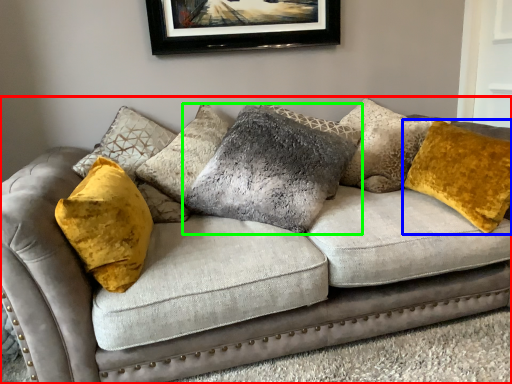
Question: Which object is the farthest from studio couch (highlighted by a red box)? Choose among these: pillow (highlighted by a blue box) or pillow (highlighted by a green box).

Choices:
 (A) pillow
 (B) pillow

Answer: (A)